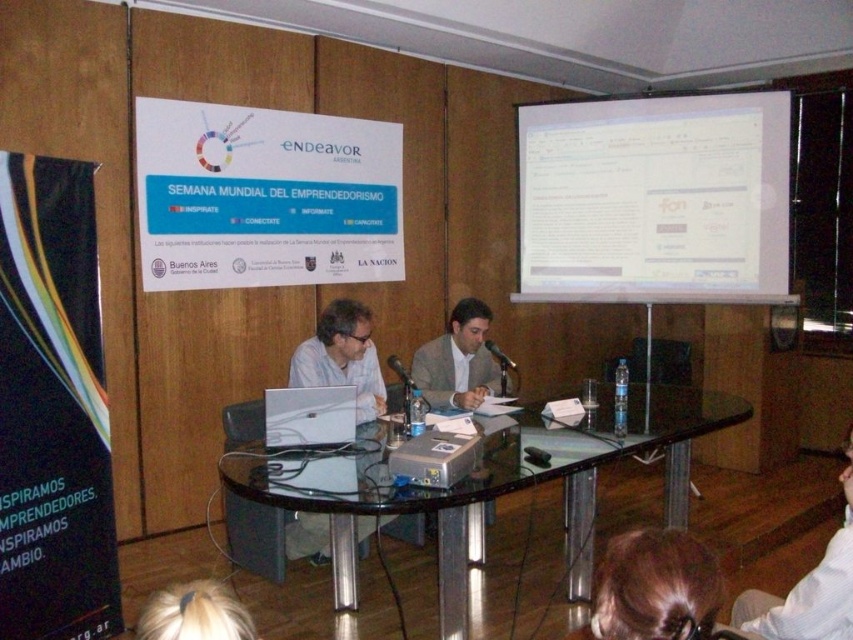
Does blonde hair at lower left have a greater width compared to silver metallic laptop at center?

Yes, blonde hair at lower left is wider than silver metallic laptop at center.

Is blonde hair at lower left taller than silver metallic laptop at center?

No.

Who is more forward, (190, 596) or (320, 401)?

Point (190, 596) is in front.

Locate an element on the screen. The width and height of the screenshot is (853, 640). blonde hair at lower left is located at coordinates (194, 612).

Between point (399, 205) and point (433, 362), which one is positioned behind?

Positioned behind is point (399, 205).

From the picture: Which of these two, white paper at upper center or light brown suit at center, stands taller?

With more height is white paper at upper center.

Find the location of `white paper at upper center`. white paper at upper center is located at coordinates (264, 196).

Locate an element on the screen. white paper at upper center is located at coordinates (264, 196).

Does light brown suit at center appear on the right side of blonde hair at lower left?

Indeed, light brown suit at center is positioned on the right side of blonde hair at lower left.

Is point (440, 339) less distant than point (178, 632)?

No, (440, 339) is further to viewer.

The width and height of the screenshot is (853, 640). Find the location of `light brown suit at center`. light brown suit at center is located at coordinates (457, 360).